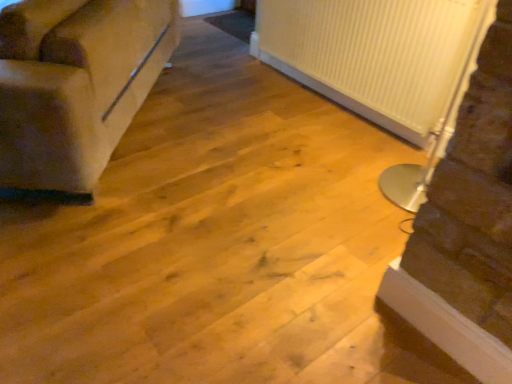
You are a GUI agent. You are given a task and a screenshot of the screen. Output one action in this format:
    pyautogui.click(x=<x>, y=<y>)
    Task: Click on the vacant space in white ribbed radiator at right (from a real-world perspective)
    This screenshot has width=512, height=384.
    Given the screenshot: What is the action you would take?
    pyautogui.click(x=391, y=180)